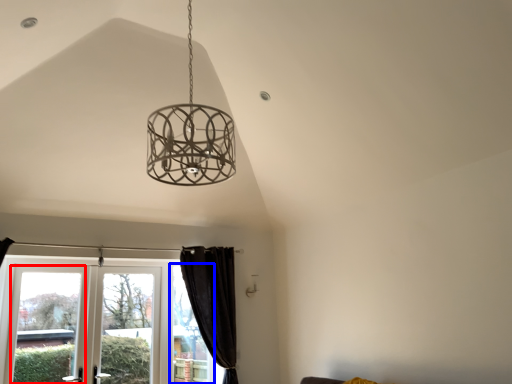
Question: Which point is closer to the camera, window (highlighted by a red box) or window (highlighted by a blue box)?

Choices:
 (A) window
 (B) window

Answer: (A)